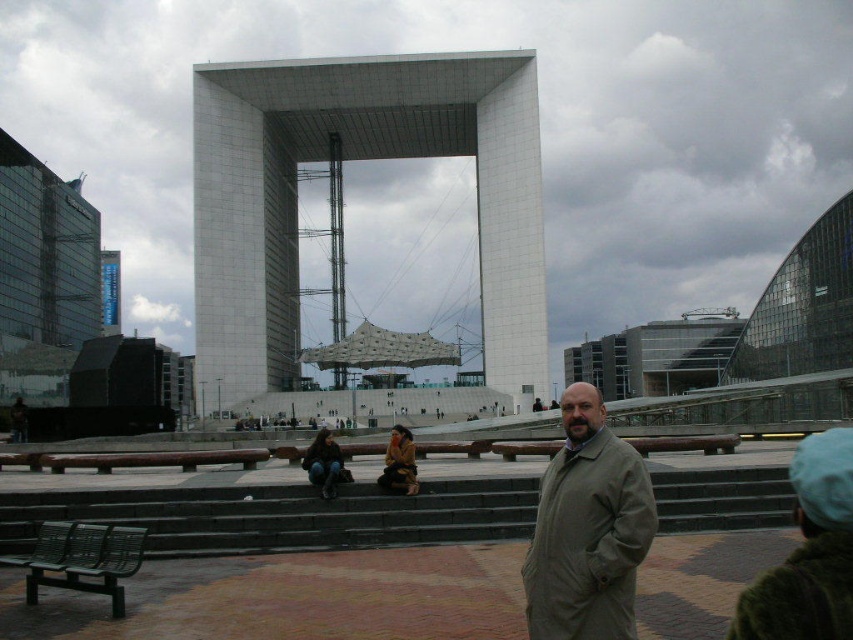
Question: Which object is farther from the camera taking this photo?

Choices:
 (A) white concrete structure at center
 (B) denim jacket at lower center

Answer: (A)

Question: Is white concrete structure at center thinner than tan fabric coat at center?

Choices:
 (A) no
 (B) yes

Answer: (A)

Question: Which point is farther to the camera?

Choices:
 (A) denim jacket at lower center
 (B) dark gray concrete stairs at center
 (C) white concrete structure at center

Answer: (C)

Question: Does white concrete structure at center have a larger size compared to tan fabric coat at center?

Choices:
 (A) no
 (B) yes

Answer: (B)

Question: Can you confirm if white concrete structure at center is positioned to the right of tan fabric coat at center?

Choices:
 (A) no
 (B) yes

Answer: (A)

Question: Which point is closer to the camera?

Choices:
 (A) denim jacket at lower center
 (B) tan fabric coat at center

Answer: (B)